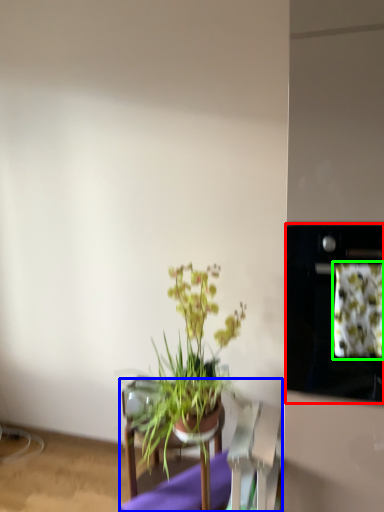
Question: Considering the real-world distances, which object is closest to oven (highlighted by a red box)? furniture (highlighted by a blue box) or flower (highlighted by a green box).

Choices:
 (A) furniture
 (B) flower

Answer: (B)